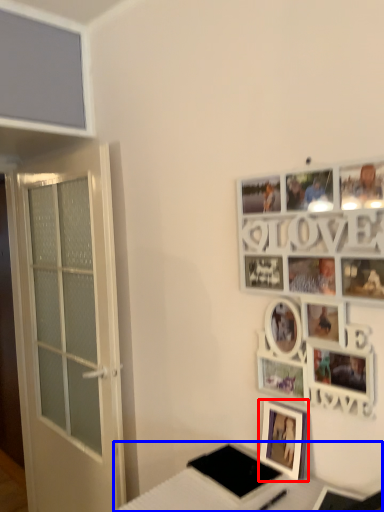
Question: Which object is closer to the camera taking this photo, picture frame (highlighted by a red box) or table (highlighted by a blue box)?

Choices:
 (A) picture frame
 (B) table

Answer: (B)